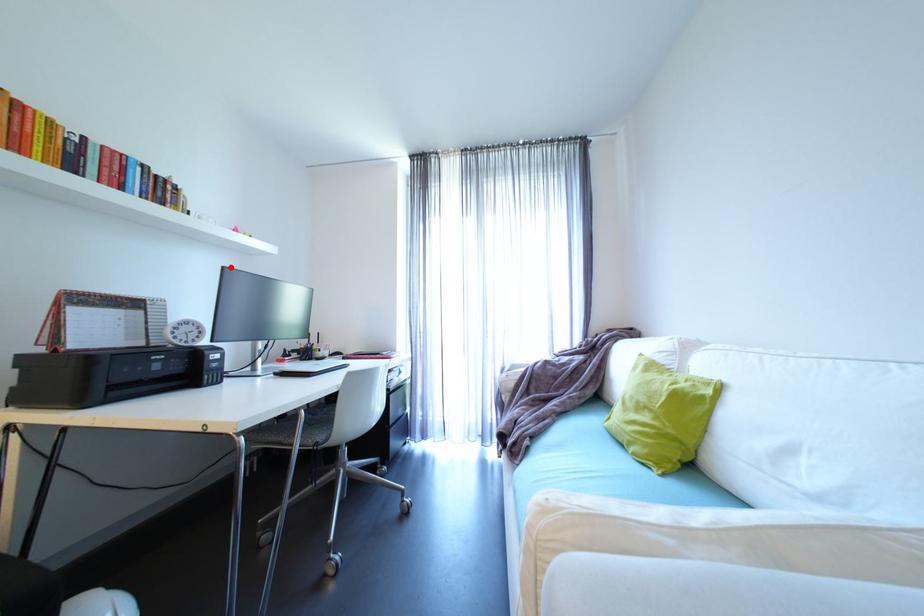
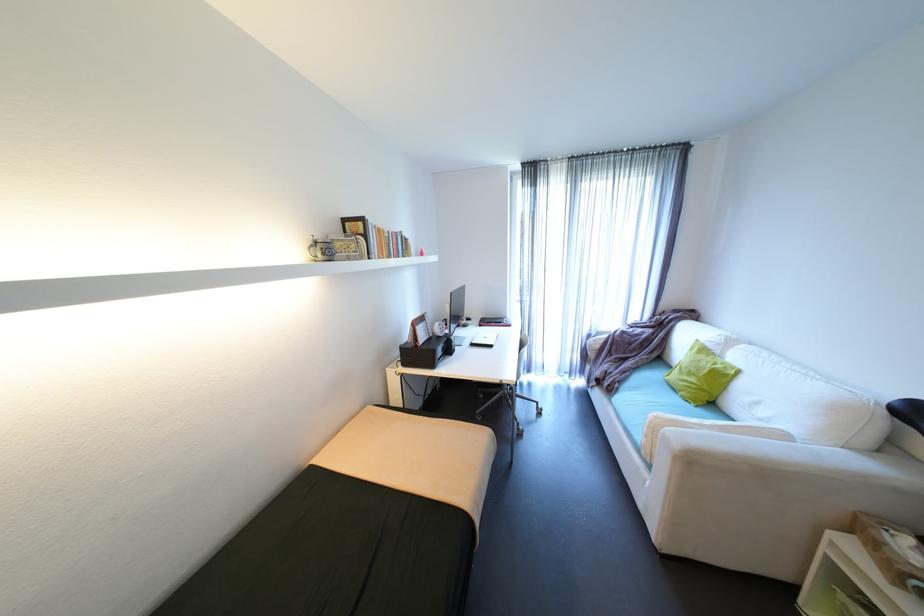
Locate, in the second image, the point that corresponds to the highlighted location in the first image.

(458, 294)